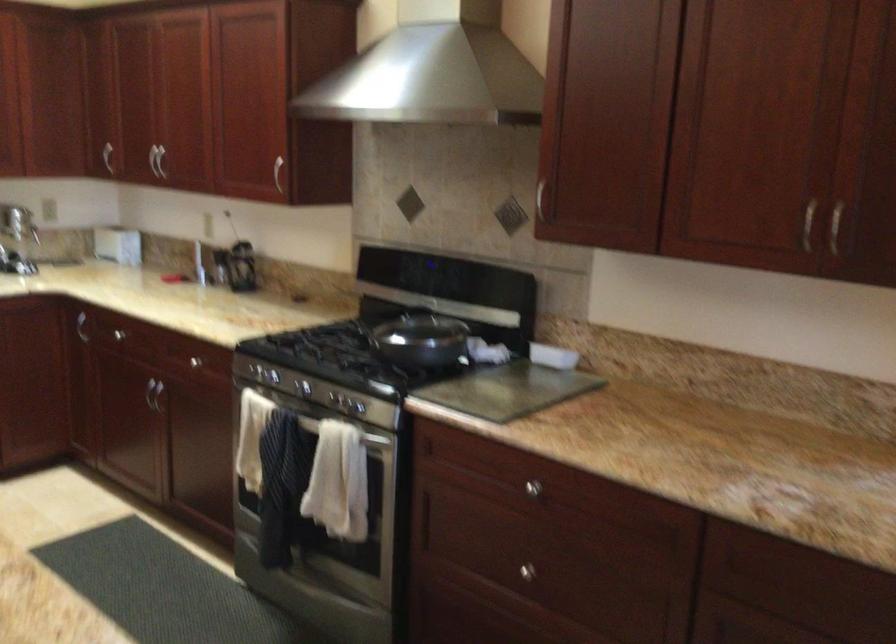
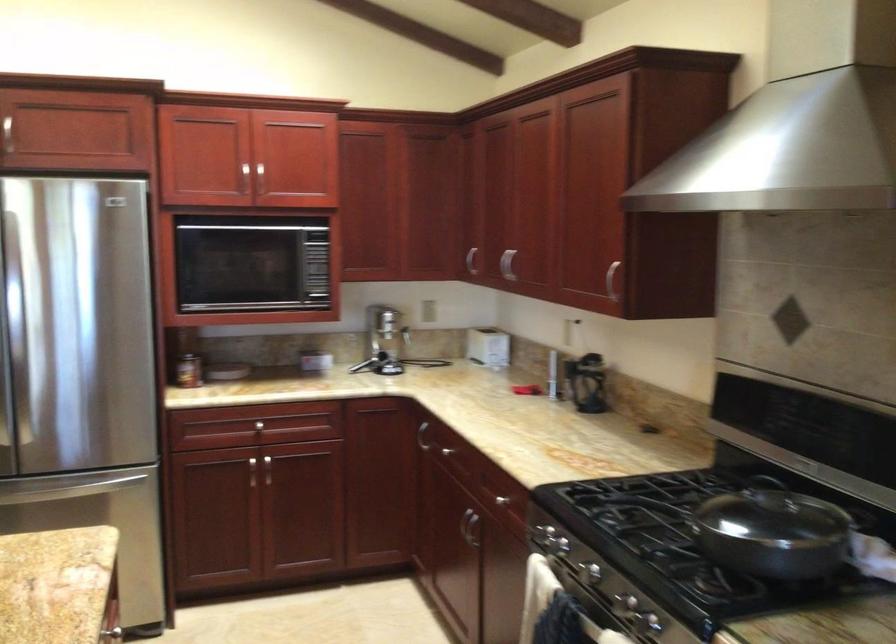
Locate, in the second image, the point that corresponds to [154,152] in the first image.

(506, 263)